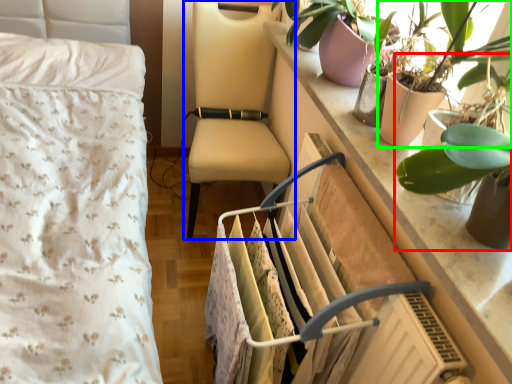
Question: Which object is the farthest from houseplant (highlighted by a red box)? Choose among these: chair (highlighted by a blue box) or houseplant (highlighted by a green box).

Choices:
 (A) chair
 (B) houseplant

Answer: (A)